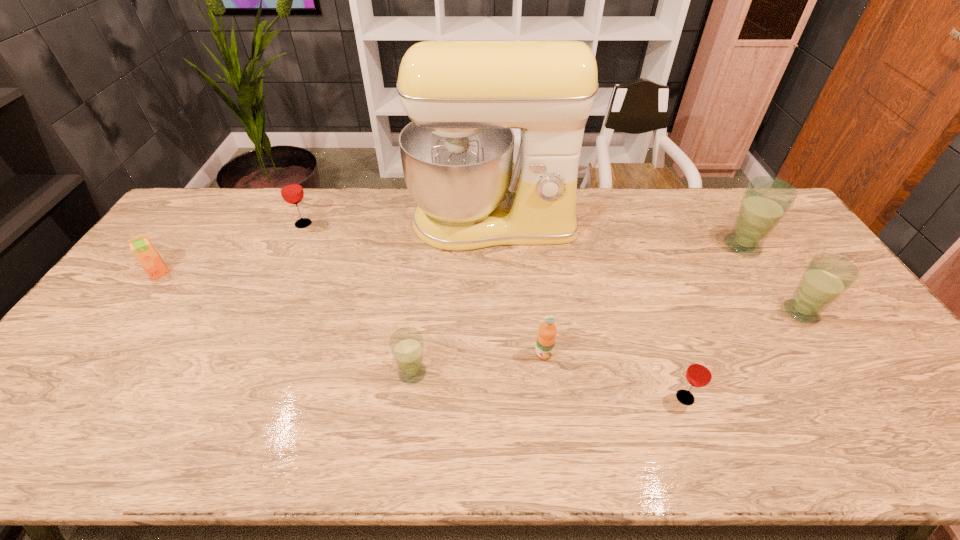
Locate an element on the screen. This screenshot has height=540, width=960. vacant space located 0.370m on the right of the fourth farthest glass is located at coordinates (576, 373).

Find the location of a particular element. free space located on the left of the third object from right to left is located at coordinates (594, 398).

Find the location of a particular element. The width and height of the screenshot is (960, 540). mixer that is at the far edge is located at coordinates (464, 97).

At what (x,y) coordinates should I click in order to perform the action: click on glass located in the far edge section of the desktop. Please return your answer as a coordinate pair (x, y). Looking at the image, I should click on (291, 190).

The width and height of the screenshot is (960, 540). What are the coordinates of `object situated at the left edge` in the screenshot? It's located at (142, 248).

Find the location of a particular element. The width and height of the screenshot is (960, 540). vacant position at the far edge of the desktop is located at coordinates (399, 215).

Where is `vacant area at the near edge`? Image resolution: width=960 pixels, height=540 pixels. vacant area at the near edge is located at coordinates click(603, 427).

Locate an element on the screen. vacant region at the left edge of the desktop is located at coordinates (130, 347).

You are a GUI agent. You are given a task and a screenshot of the screen. Output one action in this format:
    pyautogui.click(x=<x>, y=<y>)
    Task: Click on the vacant region between the farthest blue glass and the farther orange juice
    This screenshot has width=960, height=540.
    Given the screenshot: What is the action you would take?
    click(x=451, y=259)

What are the coordinates of `unoccupied area between the biggest blue glass and the mixer` in the screenshot? It's located at (617, 234).